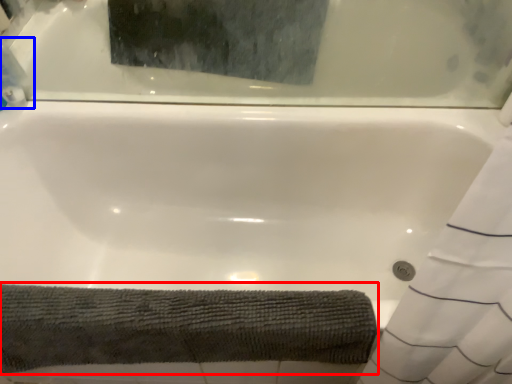
Question: Which object appears closest to the camera in this image, bath towel (highlighted by a red box) or cleaning product (highlighted by a blue box)?

Choices:
 (A) bath towel
 (B) cleaning product

Answer: (A)